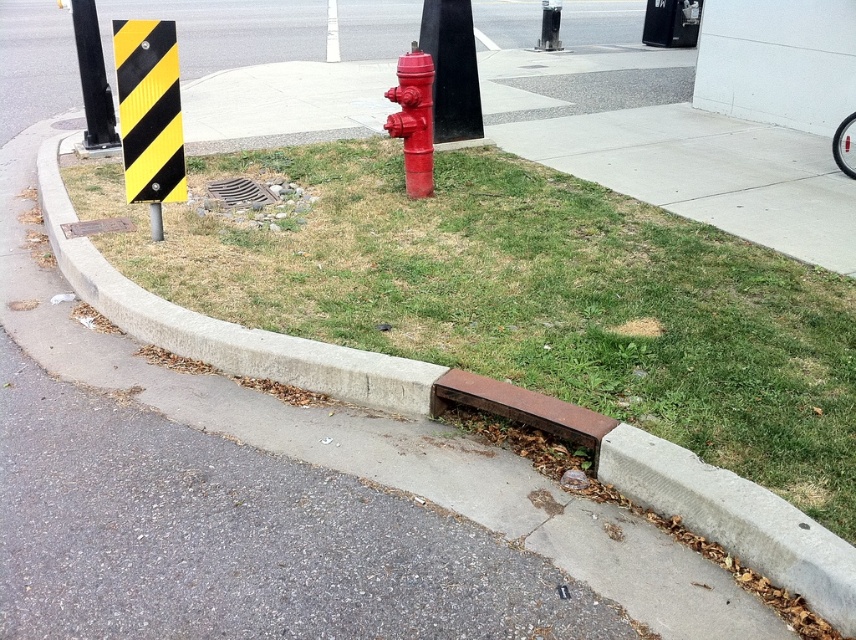
You are a gardener looking to mow the green grass at lower center. Is the metallic grate at center blocking your path to the grass?

The green grass at lower center is in front of the metallic grate at center, meaning the grate is behind the grass. Therefore, the metallic grate at center is not blocking your path to the grass.

From the picture: You are a city inspector checking the sidewalk area. You notice the green grass at lower center and the smooth black pole at center. Which object is closer to the left side of the sidewalk?

The smooth black pole at center is closer to the left side of the sidewalk because the green grass at lower center is positioned on the right side of it.

Consider the image. You are a gardener assessing the urban corner scene. You notice the green grass at lower center and the black rubber pole at upper left. Which object takes up more space in the image?

The green grass at lower center takes up more space in the image as it is larger in size than the black rubber pole at upper left.